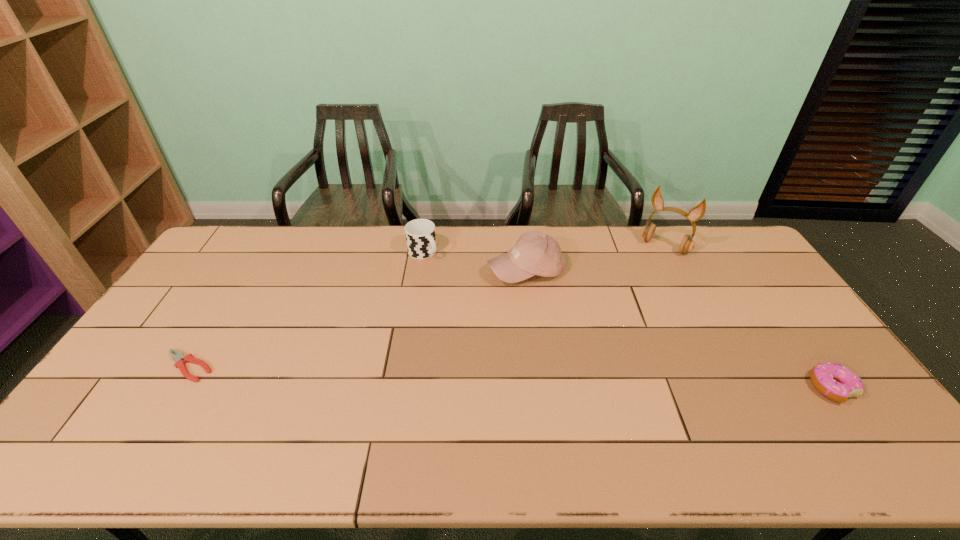
Identify the location of the leftmost object. (179, 358).

Identify the location of pliers. (179, 358).

Where is `doughnut`? This screenshot has width=960, height=540. doughnut is located at coordinates (834, 381).

This screenshot has height=540, width=960. Identify the location of the fourth tallest object. (834, 381).

Image resolution: width=960 pixels, height=540 pixels. In order to click on the third shortest object in this screenshot , I will do `click(420, 234)`.

The height and width of the screenshot is (540, 960). What are the coordinates of `the fourth object from right to left` in the screenshot? It's located at (420, 234).

I want to click on the fourth shortest object, so click(535, 253).

This screenshot has width=960, height=540. In order to click on the third object from right to left in this screenshot , I will do `click(535, 253)`.

Where is `the fourth object from left to right`? the fourth object from left to right is located at coordinates [x=696, y=213].

You are a GUI agent. You are given a task and a screenshot of the screen. Output one action in this format:
    pyautogui.click(x=<x>, y=<y>)
    Task: Click on the tallest object
    This screenshot has width=960, height=540.
    Given the screenshot: What is the action you would take?
    pyautogui.click(x=696, y=213)